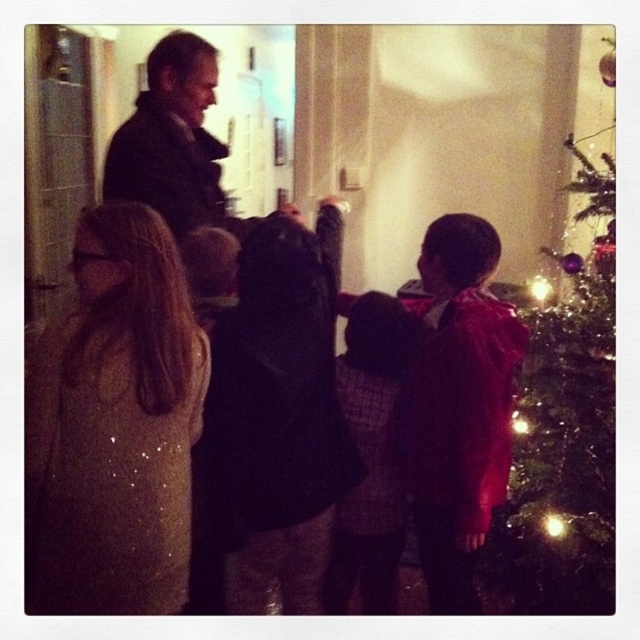
Which is above, shiny green tree at right or plaid fabric sweater at center?

shiny green tree at right

Identify the location of shiny green tree at right. (564, 429).

What do you see at coordinates (564, 429) in the screenshot? I see `shiny green tree at right` at bounding box center [564, 429].

Is shiny green tree at right below dark wool coat at upper left?

Correct, shiny green tree at right is located below dark wool coat at upper left.

Is point (576, 493) behind point (164, 198)?

That is True.

Identify the location of shiny green tree at right. (564, 429).

Who is lower down, shiny sequined coat at center or plaid fabric sweater at center?

plaid fabric sweater at center is below.

From the picture: Who is positioned more to the right, shiny sequined coat at center or plaid fabric sweater at center?

Positioned to the right is plaid fabric sweater at center.

Which is behind, point (332, 426) or point (371, 456)?

Point (371, 456)

This screenshot has width=640, height=640. What are the coordinates of `shiny sequined coat at center` in the screenshot? It's located at (115, 426).